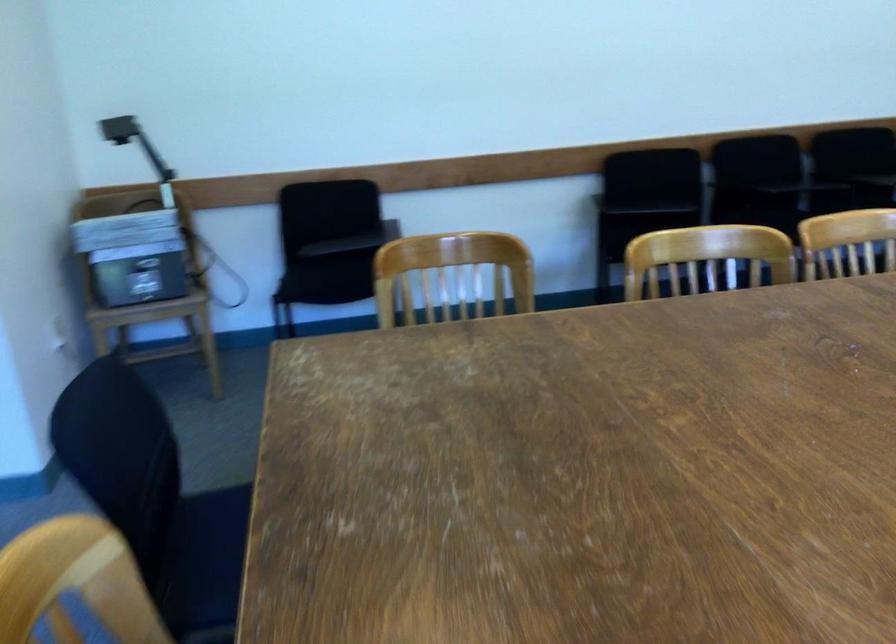
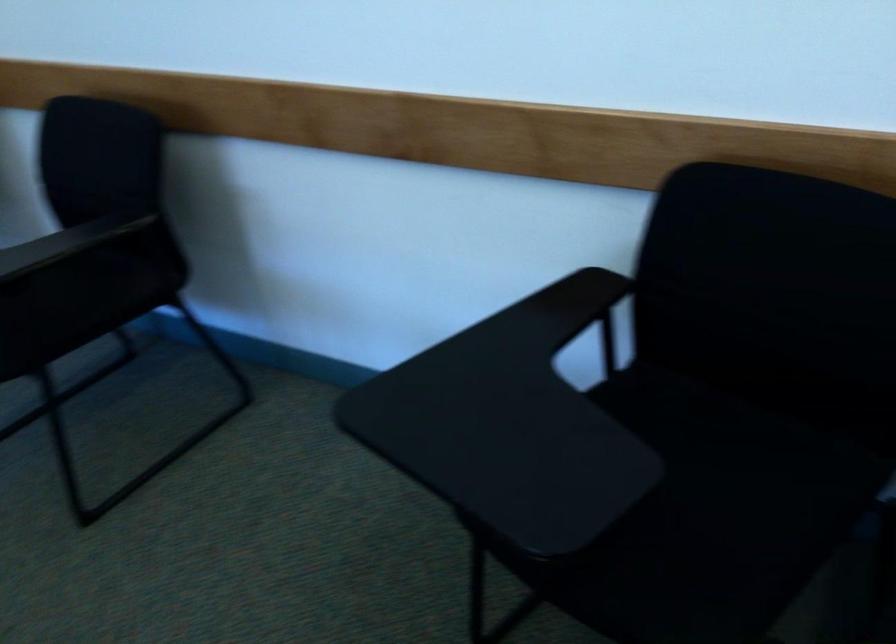
In the second image, find the point that corresponds to the point at 659,214 in the first image.

(743, 457)